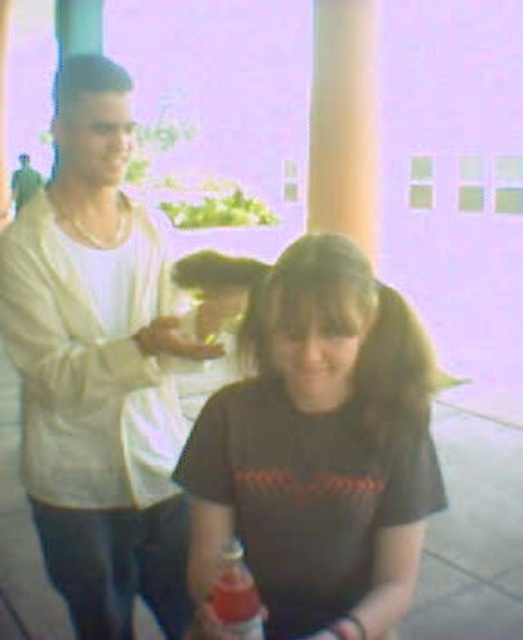
From the picture: You are trying to determine if the matte black shirt at center can fully cover the translucent plastic bottle at center when placed directly over it. Based on their sizes, is this possible?

The matte black shirt at center might be wider than the translucent plastic bottle at center, so it could potentially cover it depending on the shirt and bottle dimensions.